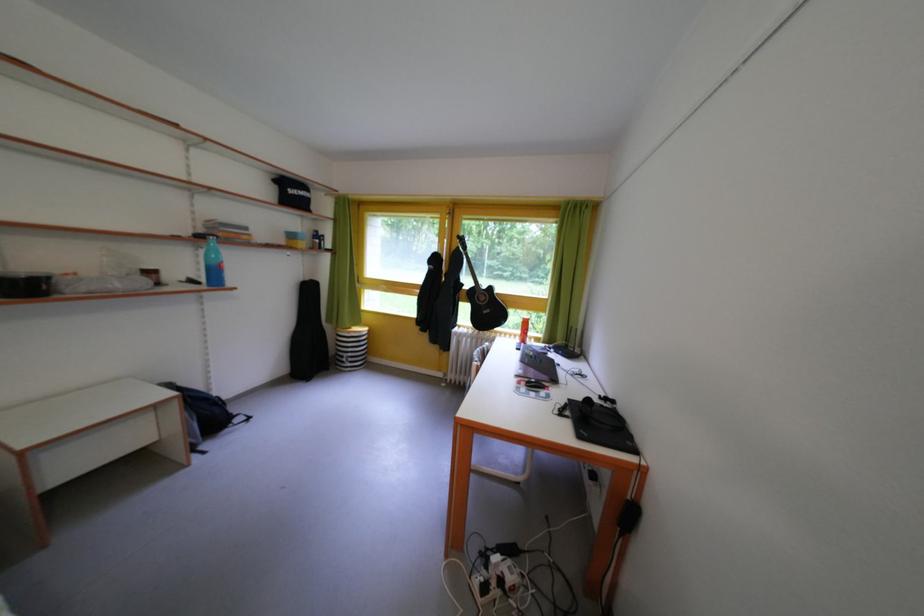
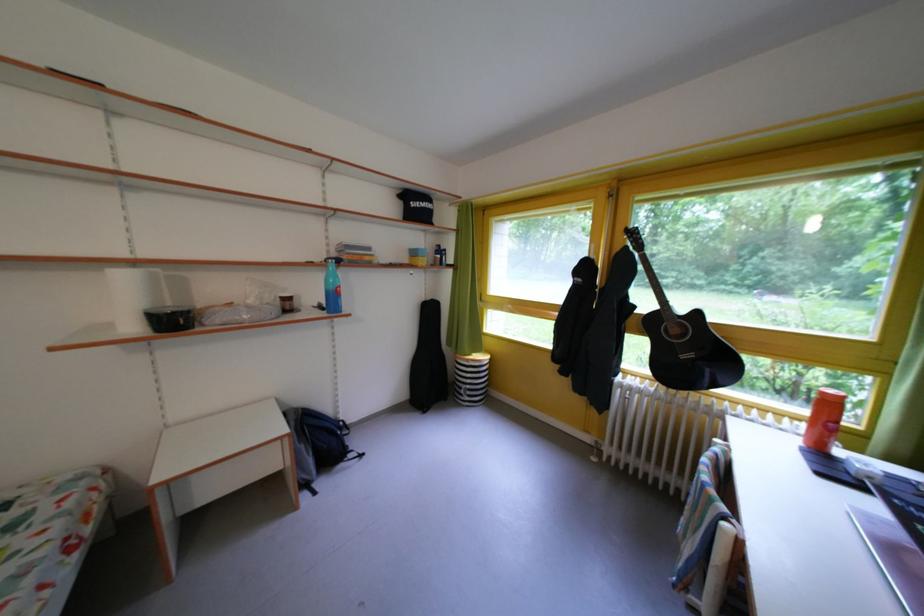
Find the pixel in the second image that matches (294,376) in the first image.

(415, 400)